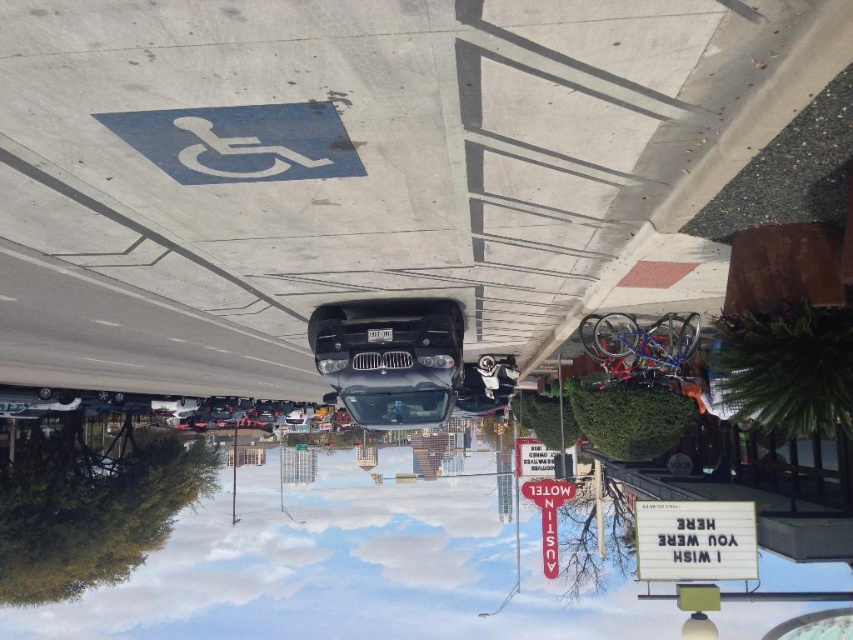
Question: Which of the following is the closest to the observer?

Choices:
 (A) (724, 556)
 (B) (457, 342)

Answer: (A)

Question: Does sleek black car at center have a larger size compared to white plastic sign at center?

Choices:
 (A) no
 (B) yes

Answer: (B)

Question: Does sleek black car at center have a lesser width compared to white plastic sign at center?

Choices:
 (A) no
 (B) yes

Answer: (A)

Question: Can you confirm if sleek black car at center is bigger than white plastic sign at center?

Choices:
 (A) yes
 (B) no

Answer: (A)

Question: Which point is closer to the camera?

Choices:
 (A) white plastic sign at center
 (B) sleek black car at center

Answer: (A)

Question: Which point appears farthest from the camera in this image?

Choices:
 (A) (701, 500)
 (B) (450, 365)

Answer: (B)